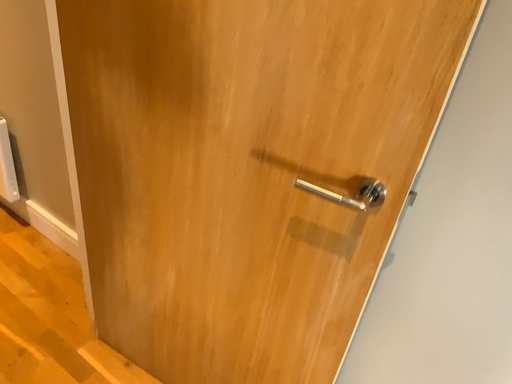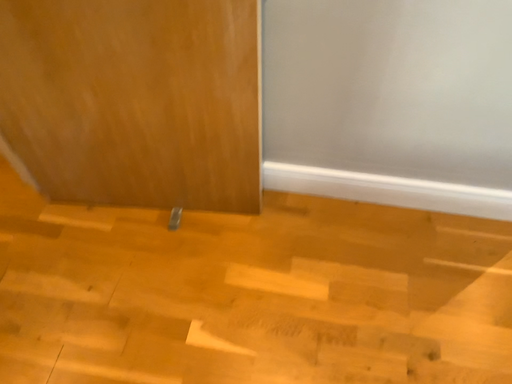
Question: Which way did the camera rotate in the video?

Choices:
 (A) rotated right
 (B) rotated left

Answer: (A)